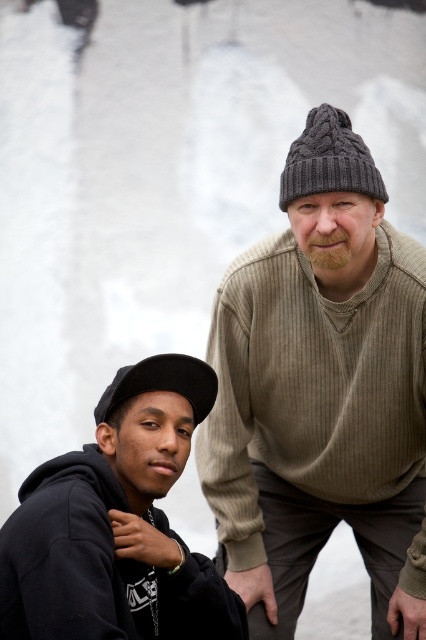
Is knitted gray beanie at upper right above black fabric cap at lower left?

No, knitted gray beanie at upper right is not above black fabric cap at lower left.

Locate an element on the screen. The image size is (426, 640). knitted gray beanie at upper right is located at coordinates (322, 394).

Is knitted gray beanie at upper right closer to the viewer compared to dark gray knitted beanie at upper right?

No.

Is point (296, 486) in front of point (344, 179)?

No, (296, 486) is further to viewer.

The width and height of the screenshot is (426, 640). Identify the location of knitted gray beanie at upper right. (322, 394).

Can you confirm if black matte hoodie at lower left is wider than dark gray knitted beanie at upper right?

Yes, black matte hoodie at lower left is wider than dark gray knitted beanie at upper right.

Does black matte hoodie at lower left have a lesser width compared to dark gray knitted beanie at upper right?

No, black matte hoodie at lower left is not thinner than dark gray knitted beanie at upper right.

Based on the photo, who is more distant from viewer, (103, 515) or (374, 161)?

The point (374, 161) is behind.

In order to click on black matte hoodie at lower left in this screenshot , I will do `click(118, 524)`.